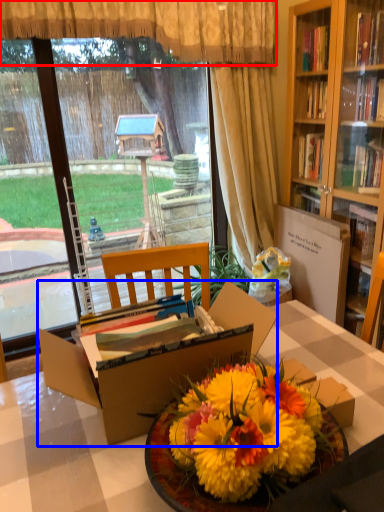
Question: Which object is further to the camera taking this photo, curtain (highlighted by a red box) or box (highlighted by a blue box)?

Choices:
 (A) curtain
 (B) box

Answer: (A)